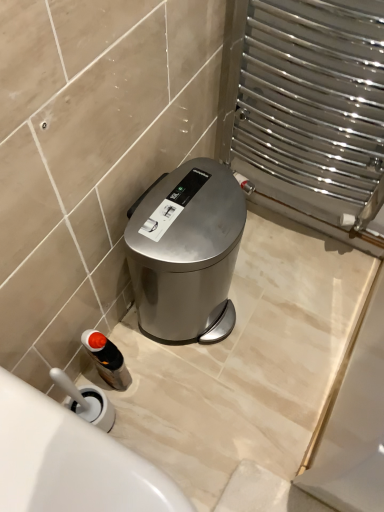
This screenshot has width=384, height=512. Identify the location of white glossy bath at lower left. (70, 461).

What is the approximate width of translucent plastic bottle at lower left?

The width of translucent plastic bottle at lower left is 2.87 inches.

What is the approximate height of translucent plastic bottle at lower left?

translucent plastic bottle at lower left is 27.07 centimeters tall.

Identify the location of white glossy bath at lower left. (70, 461).

The height and width of the screenshot is (512, 384). What are the coordinates of `bath that is in front of the translucent plastic bottle at lower left` in the screenshot? It's located at (70, 461).

Relative to white glossy bath at lower left, is translucent plastic bottle at lower left in front or behind?

Visually, translucent plastic bottle at lower left is located behind white glossy bath at lower left.

Is translucent plastic bottle at lower left placed right next to white glossy bath at lower left?

There is a gap between translucent plastic bottle at lower left and white glossy bath at lower left.

In the scene shown: From a real-world perspective, is translucent plastic bottle at lower left located higher than white glossy bath at lower left?

No, from a real-world perspective, translucent plastic bottle at lower left is not on top of white glossy bath at lower left.

Considering the sizes of objects satin silver trash can at center and translucent plastic bottle at lower left in the image provided, who is thinner, satin silver trash can at center or translucent plastic bottle at lower left?

With smaller width is translucent plastic bottle at lower left.

From the picture: Which object is more forward, satin silver trash can at center or translucent plastic bottle at lower left?

satin silver trash can at center is in front.

From the picture: How many degrees apart are the facing directions of satin silver trash can at center and translucent plastic bottle at lower left?

There is a 7.74-degree angle between the facing directions of satin silver trash can at center and translucent plastic bottle at lower left.

Considering the relative sizes of white glossy bath at lower left and satin silver trash can at center in the image provided, is white glossy bath at lower left wider than satin silver trash can at center?

Indeed, white glossy bath at lower left has a greater width compared to satin silver trash can at center.

Considering the sizes of white glossy bath at lower left and satin silver trash can at center in the image, is white glossy bath at lower left taller or shorter than satin silver trash can at center?

Clearly, white glossy bath at lower left is shorter compared to satin silver trash can at center.

Where is `waste container above the white glossy bath at lower left (from the image's perspective)`? This screenshot has height=512, width=384. waste container above the white glossy bath at lower left (from the image's perspective) is located at coordinates (186, 252).

Locate an element on the screen. The height and width of the screenshot is (512, 384). bath above the satin silver trash can at center (from a real-world perspective) is located at coordinates (70, 461).

Is white glossy bath at lower left surrounded by satin silver trash can at center?

Definitely not — white glossy bath at lower left is not inside satin silver trash can at center.

Is satin silver trash can at center next to white glossy bath at lower left?

No, satin silver trash can at center is not making contact with white glossy bath at lower left.

From the image's perspective, between satin silver trash can at center and white glossy bath at lower left, who is located below?

white glossy bath at lower left, from the image's perspective.

Is white glossy bath at lower left far from translucent plastic bottle at lower left?

white glossy bath at lower left is actually quite close to translucent plastic bottle at lower left.

Can you confirm if white glossy bath at lower left is taller than translucent plastic bottle at lower left?

Yes.

Which object is closer to the camera taking this photo, white glossy bath at lower left or translucent plastic bottle at lower left?

Positioned in front is white glossy bath at lower left.

Where is `bath located below the translucent plastic bottle at lower left (from the image's perspective)`? bath located below the translucent plastic bottle at lower left (from the image's perspective) is located at coordinates (70, 461).

Between translucent plastic bottle at lower left and satin silver trash can at center, which one has larger size?

Bigger between the two is satin silver trash can at center.

Which is more distant, [102,356] or [218,248]?

Positioned behind is point [102,356].

Is translucent plastic bottle at lower left facing towards satin silver trash can at center?

No, translucent plastic bottle at lower left is not oriented towards satin silver trash can at center.

You are a GUI agent. You are given a task and a screenshot of the screen. Output one action in this format:
    pyautogui.click(x=<x>, y=<y>)
    Task: Click on the bath on the right of translucent plastic bottle at lower left
    This screenshot has height=512, width=384.
    Given the screenshot: What is the action you would take?
    pyautogui.click(x=70, y=461)

The height and width of the screenshot is (512, 384). What are the coordinates of `waste container above the translucent plastic bottle at lower left (from the image's perspective)` in the screenshot? It's located at [186, 252].

Looking at the image, which one is located further to translucent plastic bottle at lower left, white glossy bath at lower left or satin silver trash can at center?

white glossy bath at lower left.

Looking at the image, which one is located further to translucent plastic bottle at lower left, satin silver trash can at center or white glossy bath at lower left?

white glossy bath at lower left is further to translucent plastic bottle at lower left.

Estimate the real-world distances between objects in this image. Which object is further from white glossy bath at lower left, translucent plastic bottle at lower left or satin silver trash can at center?

satin silver trash can at center lies further to white glossy bath at lower left than the other object.

Looking at the image, which one is located closer to satin silver trash can at center, translucent plastic bottle at lower left or white glossy bath at lower left?

The object closer to satin silver trash can at center is translucent plastic bottle at lower left.

Considering their positions, is white glossy bath at lower left positioned further to satin silver trash can at center than translucent plastic bottle at lower left?

white glossy bath at lower left lies further to satin silver trash can at center than the other object.

When comparing their distances from white glossy bath at lower left, does satin silver trash can at center or translucent plastic bottle at lower left seem further?

Based on the image, satin silver trash can at center appears to be further to white glossy bath at lower left.

Identify the location of waste container between white glossy bath at lower left and translucent plastic bottle at lower left in the front-back direction. (186, 252).